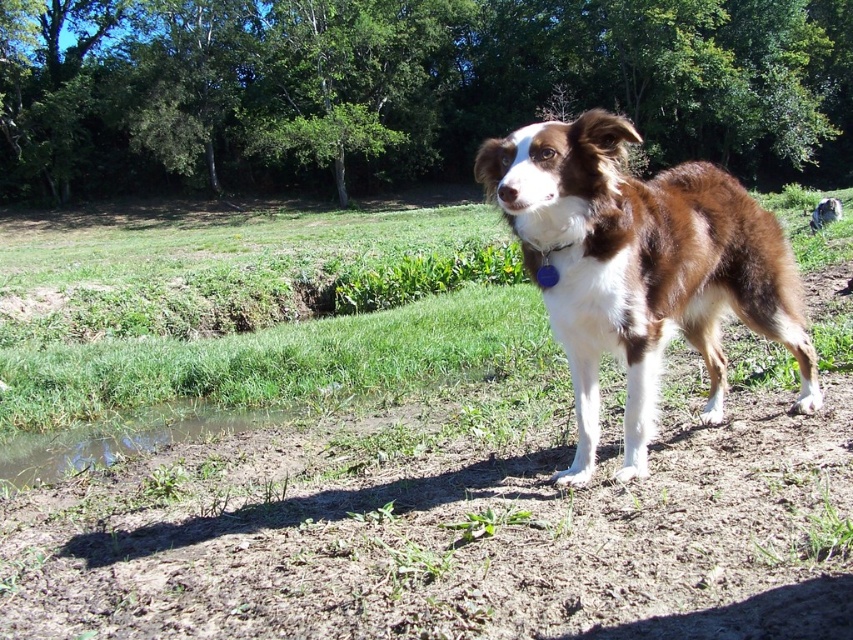
You are a photographer trying to capture the dog in the image. You want to ensure the brown dirt field at center and the green leafy tree at upper center are both visible in the frame. Which object should you focus on to include both in your shot?

To include both the brown dirt field at center and the green leafy tree at upper center in the frame, focus on the brown dirt field at center since it is closer to the camera and the tree is taller, allowing both to be captured in the shot.